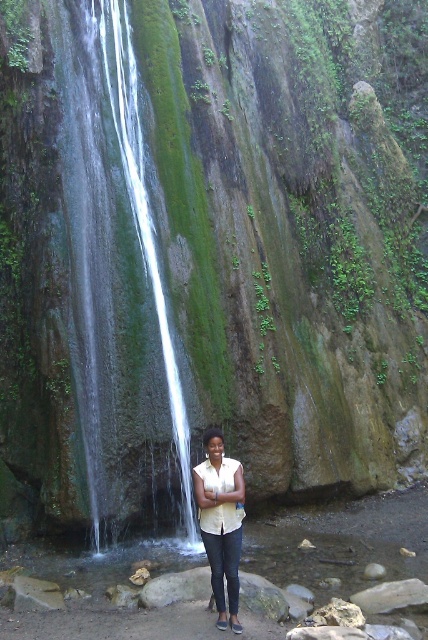
You are standing in the scene and want to take a photo of the clear glass waterfall at center. Which direction should you move to get a better view of it?

Since the clear glass waterfall at center is located at point (110, 236), you should move towards the center of the scene to get a better view of it.